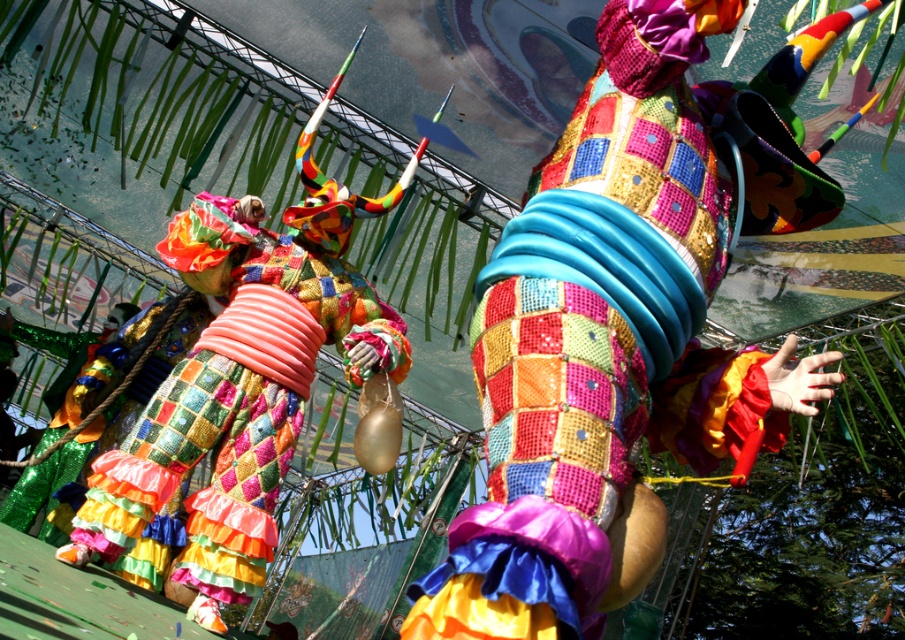
You are a stagehand setting up a performance area that requires a 1.2 meter clearance between the multicolored sequined costume at center and the multicolored sequined pants at center. Based on the image, will the current spacing meet the requirement?

The multicolored sequined costume at center is 1.10 meters from the multicolored sequined pants at center, which is less than the required 1.2 meters clearance. The current spacing does not meet the requirement.

You are a costume designer trying to decide which part of the outfit to adjust for a more balanced look. Since the multicolored sequined costume at center and the multicolored sequined pants at center are both central to the design, which one should you widen to create symmetry?

The multicolored sequined costume at center is thinner than the multicolored sequined pants at center, so you should widen the multicolored sequined costume at center to match the width of the pants for symmetry.